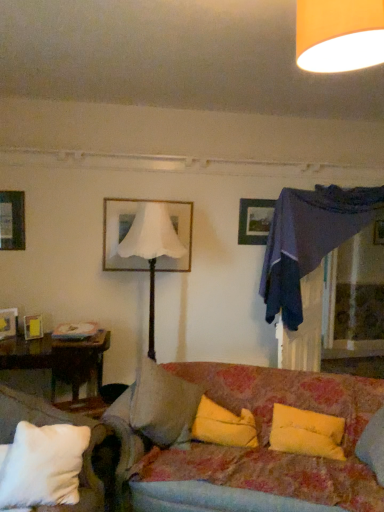
What are the coordinates of `free point behind wooden picture frame at lower left, marked as the second picture frame in a right-to-left arrangement` in the screenshot? It's located at (44, 332).